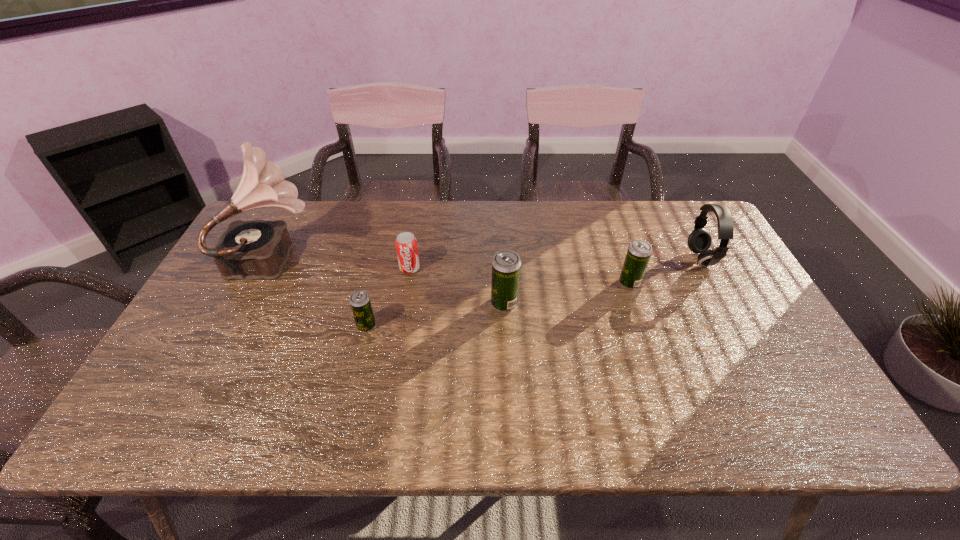
Please point a spot on the left to add another beer can. Please provide its 2D coordinates. Your answer should be formatted as a tuple, i.e. [(x, y)], where the tuple contains the x and y coordinates of a point satisfying the conditions above.

[(214, 351)]